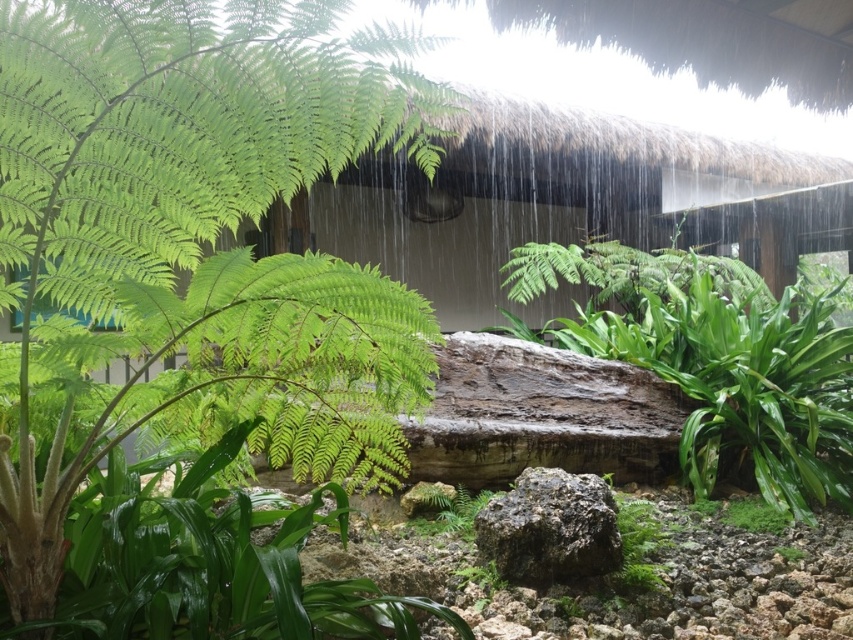
Question: Does green leafy fern at left have a smaller size compared to green leafy plant at center?

Choices:
 (A) no
 (B) yes

Answer: (B)

Question: Which point is farther from the camera taking this photo?

Choices:
 (A) (525, 570)
 (B) (692, 483)
 (C) (355, 477)

Answer: (B)

Question: Can you confirm if green leafy plant at center is positioned to the right of green mossy rock at center?

Choices:
 (A) yes
 (B) no

Answer: (A)

Question: Does green leafy plant at center have a greater width compared to green mossy rock at center?

Choices:
 (A) no
 (B) yes

Answer: (B)

Question: Which point is farther from the camera taking this photo?

Choices:
 (A) (577, 536)
 (B) (291, 188)

Answer: (A)

Question: Which of the following is the closest to the observer?

Choices:
 (A) green mossy rock at center
 (B) green leafy plant at center

Answer: (A)